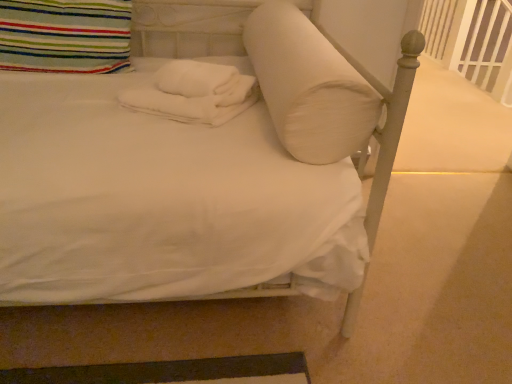
Question: From a real-world perspective, is white plastic balustrade at upper right located higher than white soft pillow at center, the second pillow when ordered from left to right?

Choices:
 (A) yes
 (B) no

Answer: (B)

Question: Can you confirm if white plastic balustrade at upper right is positioned to the left of white soft pillow at center, which is counted as the first pillow, starting from the right?

Choices:
 (A) yes
 (B) no

Answer: (B)

Question: Would you say white soft pillow at center, the second pillow when ordered from left to right, is part of white plastic balustrade at upper right's contents?

Choices:
 (A) yes
 (B) no

Answer: (B)

Question: From a real-world perspective, is white plastic balustrade at upper right below white soft pillow at center, the second pillow when ordered from left to right?

Choices:
 (A) no
 (B) yes

Answer: (B)

Question: Is the depth of white plastic balustrade at upper right less than that of white soft pillow at center, the second pillow when ordered from left to right?

Choices:
 (A) yes
 (B) no

Answer: (B)

Question: From the image's perspective, is white plastic balustrade at upper right located beneath white soft pillow at center, which is counted as the first pillow, starting from the right?

Choices:
 (A) no
 (B) yes

Answer: (A)

Question: From a real-world perspective, is white soft towels at center physically above white soft pillow at center, which is counted as the first pillow, starting from the right?

Choices:
 (A) yes
 (B) no

Answer: (B)

Question: Does white soft towels at center have a lesser height compared to white soft pillow at center, the second pillow when ordered from left to right?

Choices:
 (A) yes
 (B) no

Answer: (A)

Question: Is white soft towels at center outside of white soft pillow at center, the second pillow when ordered from left to right?

Choices:
 (A) yes
 (B) no

Answer: (A)

Question: Considering the relative sizes of white soft towels at center and white soft pillow at center, the second pillow when ordered from left to right, in the image provided, is white soft towels at center smaller than white soft pillow at center, the second pillow when ordered from left to right,?

Choices:
 (A) yes
 (B) no

Answer: (A)

Question: From a real-world perspective, is white soft towels at center below white soft pillow at center, the second pillow when ordered from left to right?

Choices:
 (A) yes
 (B) no

Answer: (A)

Question: From the image's perspective, would you say white soft towels at center is positioned over white soft pillow at center, which is counted as the first pillow, starting from the right?

Choices:
 (A) yes
 (B) no

Answer: (B)

Question: Considering the relative sizes of white plastic balustrade at upper right and white soft towels at center in the image provided, is white plastic balustrade at upper right wider than white soft towels at center?

Choices:
 (A) yes
 (B) no

Answer: (B)